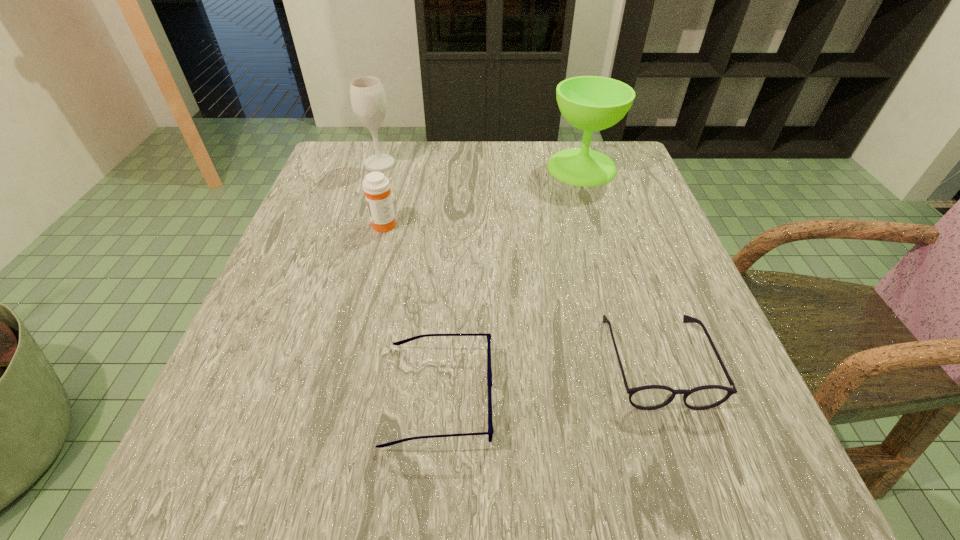
Where is `vacant space at the far left corner`? The height and width of the screenshot is (540, 960). vacant space at the far left corner is located at coordinates (367, 145).

In the image, there is a desktop. Identify the location of vacant space at the near left corner. (242, 447).

In the image, there is a desktop. Where is `vacant space at the far right corner`? The height and width of the screenshot is (540, 960). vacant space at the far right corner is located at coordinates click(x=616, y=142).

This screenshot has height=540, width=960. In order to click on free space at the near right corner of the desktop in this screenshot , I will do `click(692, 460)`.

Find the location of a particular element. This screenshot has height=540, width=960. blank region between the left wineglass and the right spectacles is located at coordinates (518, 262).

I want to click on unoccupied area between the left wineglass and the right spectacles, so click(x=518, y=262).

Image resolution: width=960 pixels, height=540 pixels. Identify the location of empty space that is in between the medicine and the left spectacles. (412, 309).

Locate an element on the screen. The image size is (960, 540). free area in between the right spectacles and the left spectacles is located at coordinates (547, 378).

I want to click on vacant space that's between the right spectacles and the left spectacles, so click(547, 378).

Image resolution: width=960 pixels, height=540 pixels. I want to click on blank region between the right spectacles and the right wineglass, so click(619, 264).